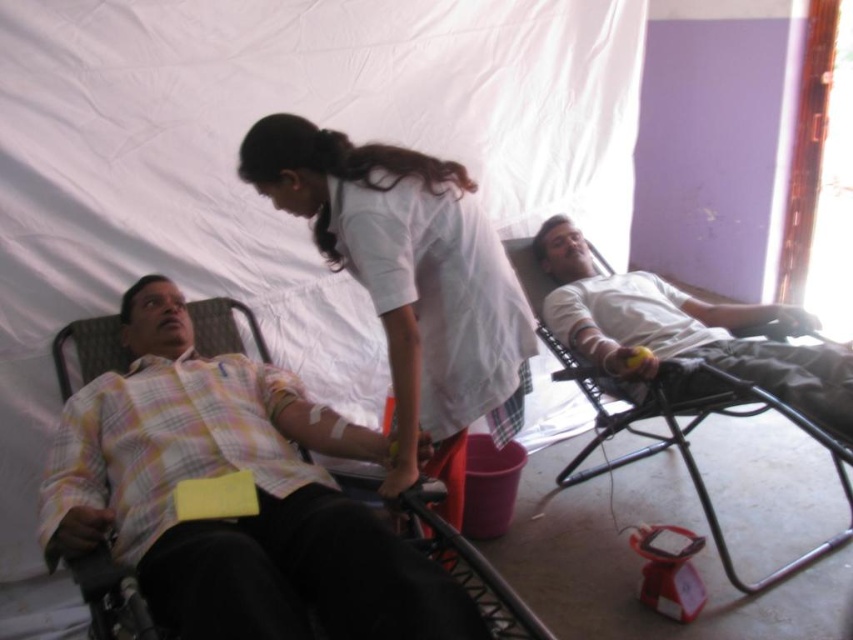
Does yellow plaid shirt at left appear under white smooth shirt at center?

Yes.

Who is positioned more to the right, yellow plaid shirt at left or white smooth shirt at center?

From the viewer's perspective, white smooth shirt at center appears more on the right side.

Between point (282, 497) and point (456, 417), which one is positioned in front?

Point (282, 497) is more forward.

At what (x,y) coordinates should I click in order to perform the action: click on yellow plaid shirt at left. Please return your answer as a coordinate pair (x, y). Looking at the image, I should click on (241, 516).

Image resolution: width=853 pixels, height=640 pixels. In order to click on white smooth shirt at center in this screenshot , I will do `click(408, 278)`.

Is white smooth shirt at center shorter than white matte shirt at right?

No.

Does point (512, 326) come behind point (585, 252)?

No, it is not.

This screenshot has height=640, width=853. What are the coordinates of `white smooth shirt at center` in the screenshot? It's located at (408, 278).

Between yellow plaid shirt at left and white matte shirt at right, which one appears on the right side from the viewer's perspective?

white matte shirt at right

Can you confirm if yellow plaid shirt at left is shorter than white matte shirt at right?

Correct, yellow plaid shirt at left is not as tall as white matte shirt at right.

Between point (148, 380) and point (699, 333), which one is positioned behind?

Positioned behind is point (699, 333).

Where is `yellow plaid shirt at left`? yellow plaid shirt at left is located at coordinates (241, 516).